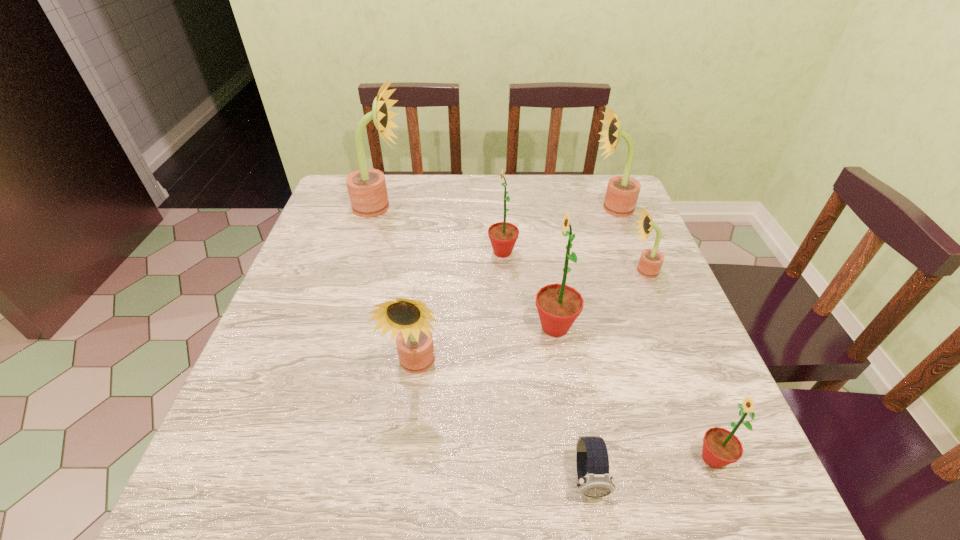
Find the location of a particular element. Image resolution: width=960 pixels, height=540 pixels. vacant space positioned 0.280m on the face of the biggest green sunflower is located at coordinates click(402, 327).

The width and height of the screenshot is (960, 540). I want to click on vacant region located 0.130m on the face of the leftmost green sunflower, so click(437, 252).

At what (x,y) coordinates should I click in order to perform the action: click on free space located on the face of the leftmost green sunflower. Please return your answer as a coordinate pair (x, y). Looking at the image, I should click on (374, 252).

The image size is (960, 540). What are the coordinates of `free space located 0.130m on the face of the leftmost green sunflower` in the screenshot? It's located at (437, 252).

Image resolution: width=960 pixels, height=540 pixels. Find the location of `free space located on the face of the nearest yellow sunflower`. free space located on the face of the nearest yellow sunflower is located at coordinates (398, 511).

The height and width of the screenshot is (540, 960). Identify the location of blank area located on the face of the third farthest yellow sunflower. (501, 271).

Identify the location of blank space located 0.080m on the face of the third farthest yellow sunflower. (594, 271).

In order to click on vacant region located 0.180m on the face of the third farthest yellow sunflower in this screenshot , I will do `click(554, 271)`.

Where is `vacant space positioned 0.390m on the face of the nearest sunflower`? vacant space positioned 0.390m on the face of the nearest sunflower is located at coordinates 463,458.

Image resolution: width=960 pixels, height=540 pixels. In order to click on free space located on the face of the nearest sunflower in this screenshot , I will do `click(504, 458)`.